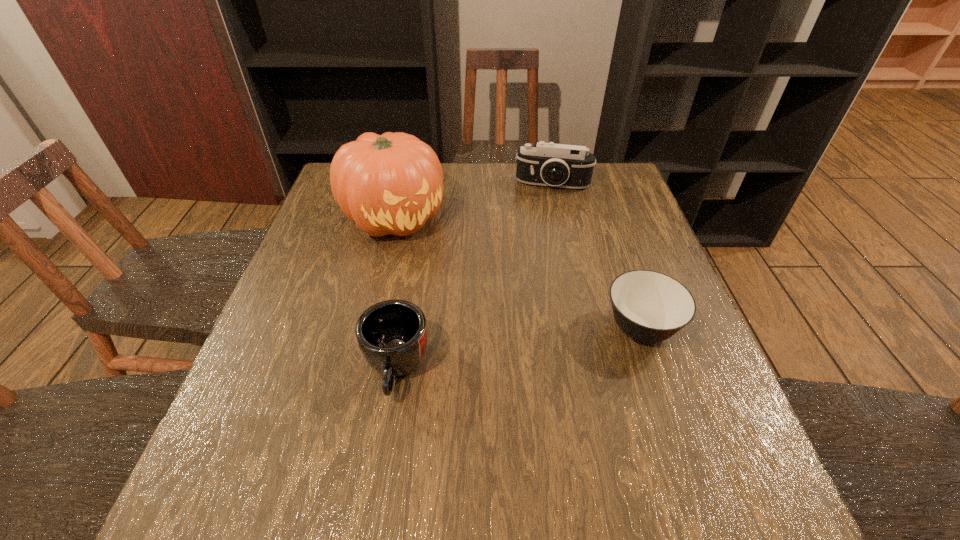
The height and width of the screenshot is (540, 960). In order to click on mug in this screenshot , I will do [392, 335].

Where is `the shortest object`? This screenshot has height=540, width=960. the shortest object is located at coordinates (649, 306).

Where is `camera`? camera is located at coordinates (558, 165).

The height and width of the screenshot is (540, 960). What are the coordinates of `pumpkin` in the screenshot? It's located at (392, 183).

Where is `free space located 0.050m on the side of the mug with the handle`? The image size is (960, 540). free space located 0.050m on the side of the mug with the handle is located at coordinates (385, 435).

This screenshot has width=960, height=540. I want to click on vacant space situated 0.060m on the back of the shortest object, so click(625, 281).

I want to click on free space located on the front lens of the camera, so click(540, 247).

Where is `blank area located on the front lens of the camera`? Image resolution: width=960 pixels, height=540 pixels. blank area located on the front lens of the camera is located at coordinates (543, 226).

At what (x,y) coordinates should I click in order to perform the action: click on vacant space located 0.180m on the front lens of the camera. Please return your answer as a coordinate pair (x, y). Looking at the image, I should click on (543, 231).

Find the location of a particular element. The image size is (960, 540). vacant area situated on the carved face of the pumpkin is located at coordinates (478, 300).